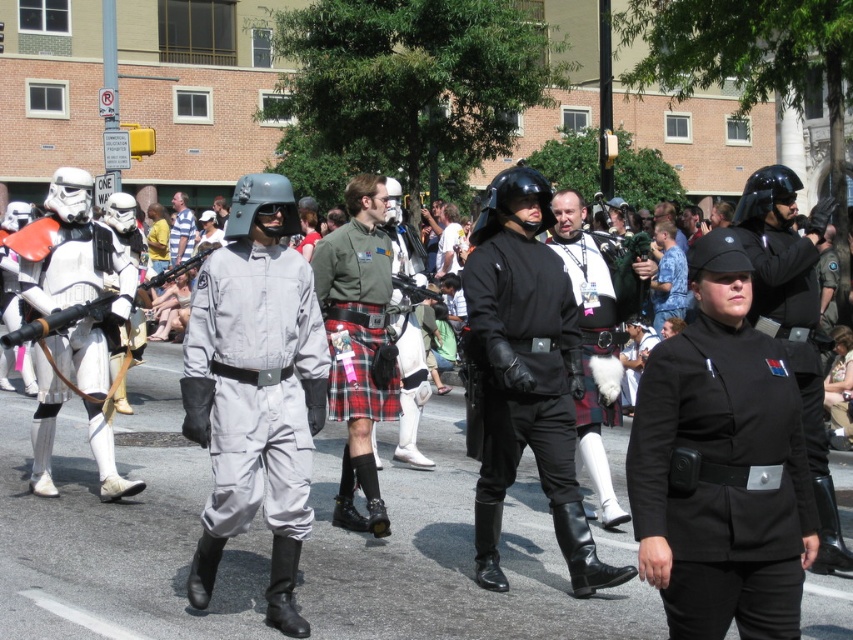
Question: Does black matte helmet at center appear over black leather jacket at center?

Choices:
 (A) no
 (B) yes

Answer: (B)

Question: Is black matte helmet at center bigger than black leather jacket at center?

Choices:
 (A) no
 (B) yes

Answer: (A)

Question: Among these objects, which one is farthest from the camera?

Choices:
 (A) black matte helmet at center
 (B) gray matte jumpsuit at center

Answer: (A)

Question: Which object is closer to the camera taking this photo?

Choices:
 (A) black leather jacket at center
 (B) black matte helmet at center

Answer: (B)

Question: Does matte black uniform at center have a larger size compared to black matte uniform at center?

Choices:
 (A) no
 (B) yes

Answer: (A)

Question: Which point is farther to the camera?

Choices:
 (A) (393, 548)
 (B) (798, 243)
 (C) (308, 289)

Answer: (A)